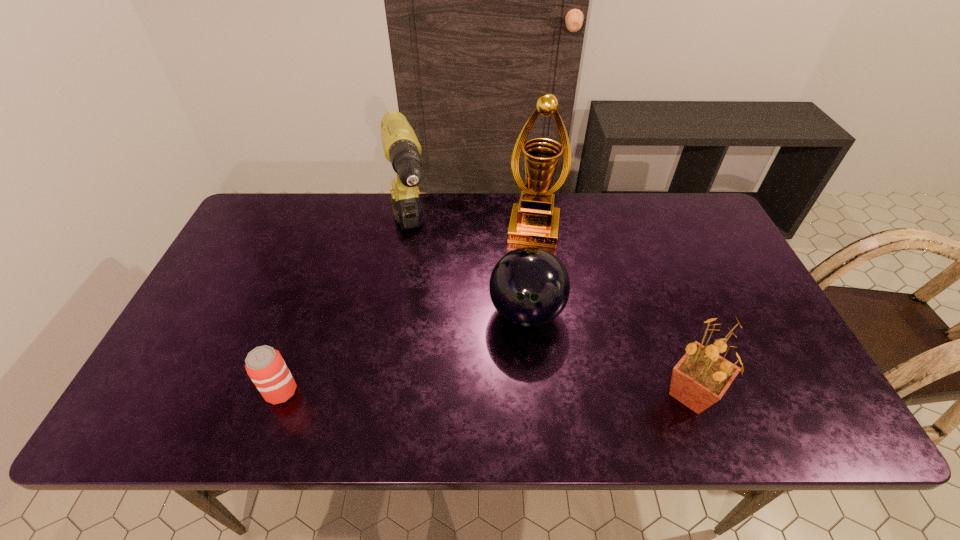
Where is `blank space at the near left corner of the desktop`? Image resolution: width=960 pixels, height=540 pixels. blank space at the near left corner of the desktop is located at coordinates (176, 386).

The width and height of the screenshot is (960, 540). In the image, there is a desktop. Find the location of `free space at the far right corner`. free space at the far right corner is located at coordinates (677, 218).

Where is `free space at the near right corner`? free space at the near right corner is located at coordinates (773, 380).

Identify the location of empty location between the tallest object and the shortest object. The image size is (960, 540). pyautogui.click(x=407, y=310).

Identify the location of vacant region between the fourth object from right to left and the award. (472, 231).

Identify the location of vacant space that's between the third shortest object and the leftmost object. This screenshot has width=960, height=540. (486, 393).

You are a GUI agent. You are given a task and a screenshot of the screen. Output one action in this format:
    pyautogui.click(x=<x>, y=<y>)
    Task: Click on the free spot between the rightmost object and the leftmost object
    
    Given the screenshot: What is the action you would take?
    pyautogui.click(x=486, y=393)

At what (x,y) coordinates should I click in order to perform the action: click on blank region between the sunflower and the fourth tallest object. Please return your answer as a coordinate pair (x, y). This screenshot has height=540, width=960. Looking at the image, I should click on (609, 353).

This screenshot has height=540, width=960. I want to click on empty space between the drill and the fourth tallest object, so click(x=468, y=274).

You are a GUI agent. You are given a task and a screenshot of the screen. Output one action in this format:
    pyautogui.click(x=<x>, y=<y>)
    Task: Click on the free spot between the fourth tallest object and the third shortest object
    Image resolution: width=960 pixels, height=540 pixels.
    Given the screenshot: What is the action you would take?
    (609, 353)